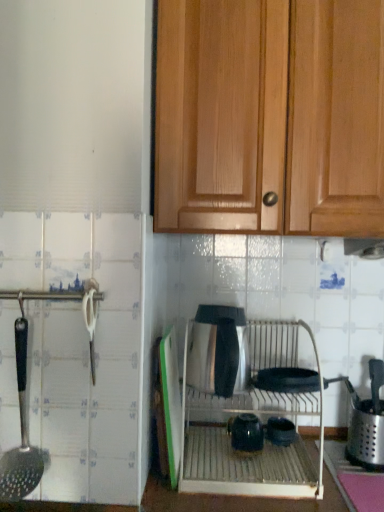
Question: From a real-world perspective, is satin silver exhaust hood at upper center located higher than satin silver oven at center?

Choices:
 (A) yes
 (B) no

Answer: (A)

Question: Is satin silver exhaust hood at upper center at the left side of satin silver oven at center?

Choices:
 (A) yes
 (B) no

Answer: (B)

Question: Does satin silver exhaust hood at upper center have a lesser height compared to satin silver oven at center?

Choices:
 (A) yes
 (B) no

Answer: (A)

Question: Considering the relative sizes of satin silver exhaust hood at upper center and satin silver oven at center in the image provided, is satin silver exhaust hood at upper center smaller than satin silver oven at center?

Choices:
 (A) yes
 (B) no

Answer: (A)

Question: Does satin silver exhaust hood at upper center have a larger size compared to satin silver oven at center?

Choices:
 (A) yes
 (B) no

Answer: (B)

Question: Is satin silver exhaust hood at upper center positioned beyond the bounds of satin silver oven at center?

Choices:
 (A) no
 (B) yes

Answer: (B)

Question: Can you confirm if wooden cabinet at upper center is positioned to the left of glossy ceramic tea pot at center?

Choices:
 (A) no
 (B) yes

Answer: (A)

Question: Considering the relative sizes of wooden cabinet at upper center and glossy ceramic tea pot at center in the image provided, is wooden cabinet at upper center bigger than glossy ceramic tea pot at center?

Choices:
 (A) no
 (B) yes

Answer: (B)

Question: From the image's perspective, is wooden cabinet at upper center located beneath glossy ceramic tea pot at center?

Choices:
 (A) yes
 (B) no

Answer: (B)

Question: Would you consider wooden cabinet at upper center to be distant from glossy ceramic tea pot at center?

Choices:
 (A) yes
 (B) no

Answer: (B)

Question: Is wooden cabinet at upper center positioned behind glossy ceramic tea pot at center?

Choices:
 (A) no
 (B) yes

Answer: (A)

Question: Is wooden cabinet at upper center taller than glossy ceramic tea pot at center?

Choices:
 (A) no
 (B) yes

Answer: (B)

Question: Is glossy ceramic tea pot at center far away from satin silver kettle at center, the first appliance from the left?

Choices:
 (A) yes
 (B) no

Answer: (B)